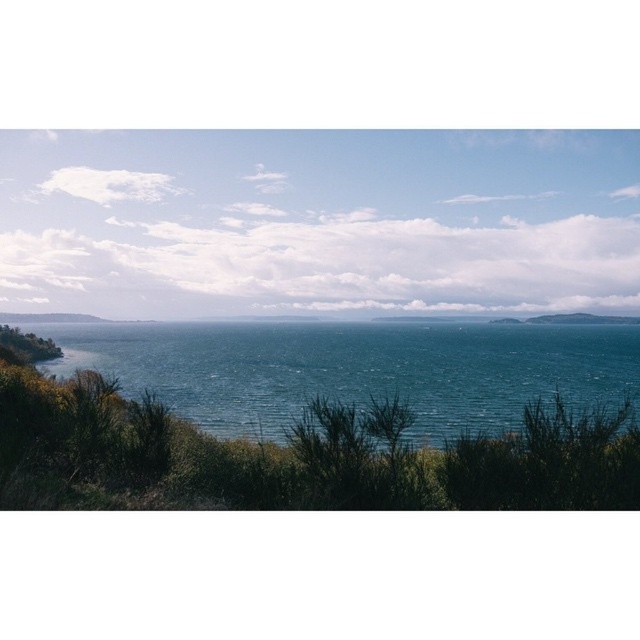
Between teal glossy water at center and blue water at center, which one has less height?

blue water at center

Which is more to the left, teal glossy water at center or blue water at center?

blue water at center is more to the left.

The image size is (640, 640). Describe the element at coordinates (355, 369) in the screenshot. I see `teal glossy water at center` at that location.

The height and width of the screenshot is (640, 640). Identify the location of teal glossy water at center. (355, 369).